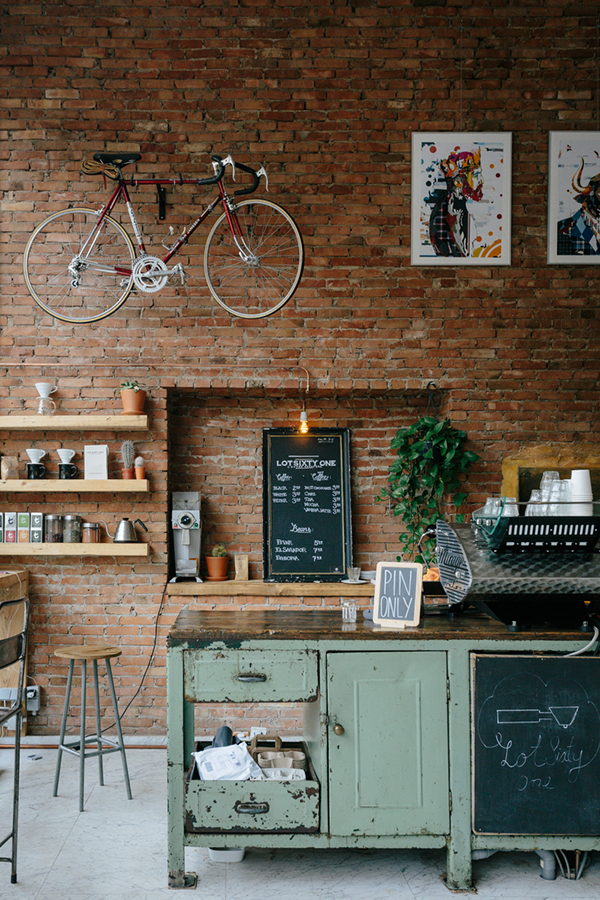
The image size is (600, 900). I want to click on wall, so click(325, 160).